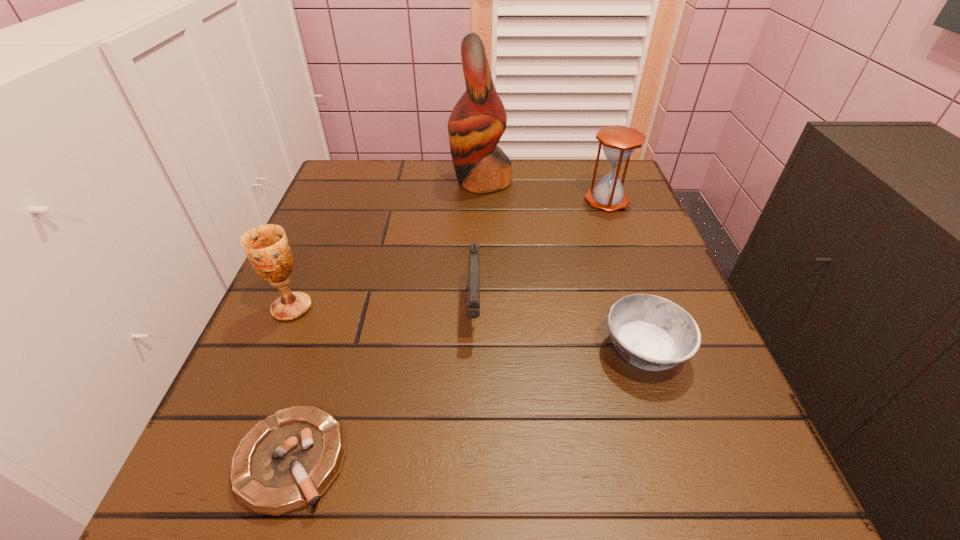
I want to click on vacant space located on the face of the parrot, so click(x=411, y=181).

Where is `vacant space located 0.380m on the left of the hourglass`? Image resolution: width=960 pixels, height=540 pixels. vacant space located 0.380m on the left of the hourglass is located at coordinates (425, 200).

Where is `free space located on the front of the chalice`? free space located on the front of the chalice is located at coordinates (x=204, y=513).

Find the location of a particular element. vacant space situated 0.140m at the barrel of the third shortest object is located at coordinates (473, 420).

Identify the location of free spot located 0.250m on the left of the right ashtray. The height and width of the screenshot is (540, 960). (448, 350).

This screenshot has width=960, height=540. In order to click on vacant point located on the back of the shorter ashtray in this screenshot , I will do `click(317, 382)`.

Where is `parrot that is at the far edge`? This screenshot has height=540, width=960. parrot that is at the far edge is located at coordinates (477, 122).

The width and height of the screenshot is (960, 540). What are the coordinates of `hourglass that is positioned at the far edge` in the screenshot? It's located at (619, 142).

At what (x,y) coordinates should I click in order to perform the action: click on object that is at the near edge. Please return your answer as a coordinate pair (x, y). Image resolution: width=960 pixels, height=540 pixels. Looking at the image, I should click on (286, 462).

The height and width of the screenshot is (540, 960). In order to click on chalice that is at the left edge in this screenshot , I will do `click(266, 246)`.